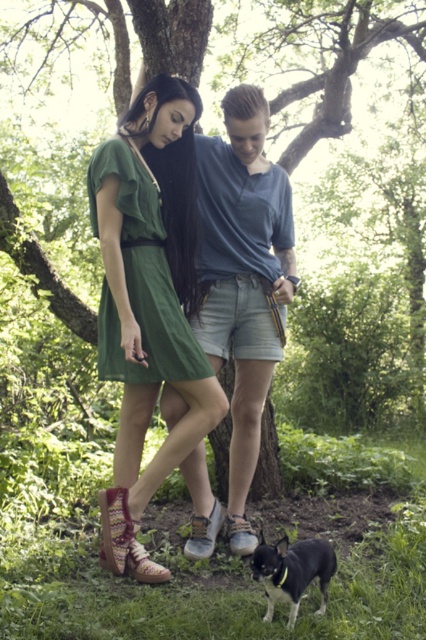
Looking at this image, can you confirm if green fabric dress at center is wider than black matte dog at lower center?

Yes, green fabric dress at center is wider than black matte dog at lower center.

Is green fabric dress at center below black matte dog at lower center?

Incorrect, green fabric dress at center is not positioned below black matte dog at lower center.

Locate an element on the screen. This screenshot has width=426, height=640. green fabric dress at center is located at coordinates (149, 301).

You are a GUI agent. You are given a task and a screenshot of the screen. Output one action in this format:
    pyautogui.click(x=<x>, y=<y>)
    Task: Click on the green fabric dress at center
    Image resolution: width=426 pixels, height=640 pixels.
    Given the screenshot: What is the action you would take?
    pyautogui.click(x=149, y=301)

Can you confirm if blue cotton shirt at center is positioned above black matte dog at lower center?

Yes, blue cotton shirt at center is above black matte dog at lower center.

Identify the location of blue cotton shirt at center. (242, 276).

The height and width of the screenshot is (640, 426). Find the location of `blue cotton shirt at center`. blue cotton shirt at center is located at coordinates (242, 276).

Can you confirm if green fabric dress at center is smaller than blue cotton shirt at center?

Yes, green fabric dress at center is smaller than blue cotton shirt at center.

Between point (164, 192) and point (227, 211), which one is positioned in front?

Positioned in front is point (164, 192).

The height and width of the screenshot is (640, 426). Find the location of `green fabric dress at center`. green fabric dress at center is located at coordinates (149, 301).